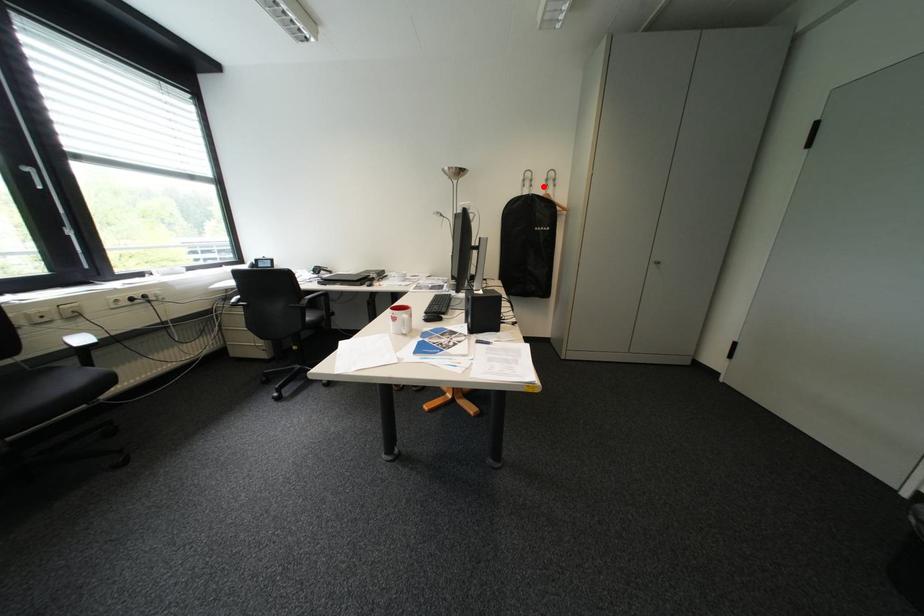
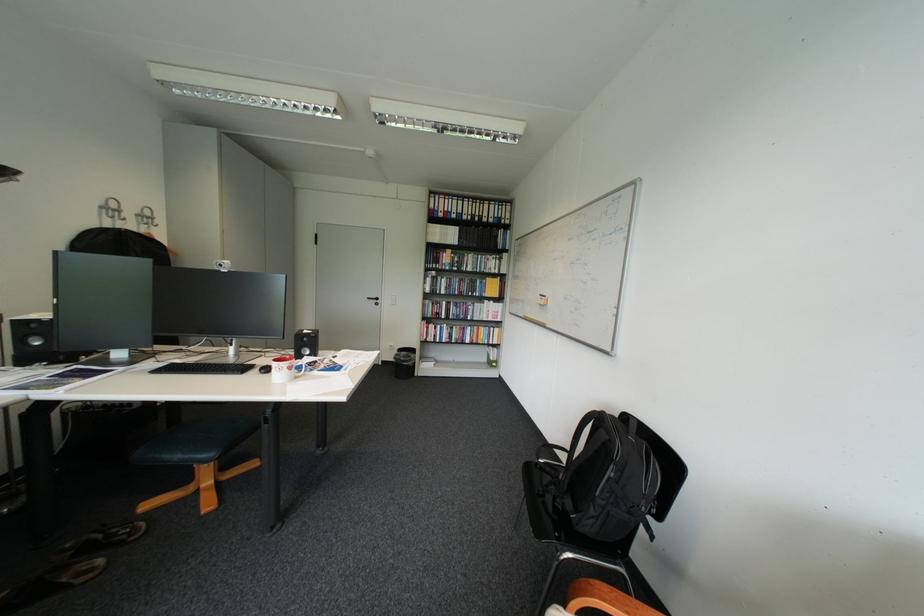
Where in the second image is the point corresponding to the highlighted location from the first image?

(137, 220)